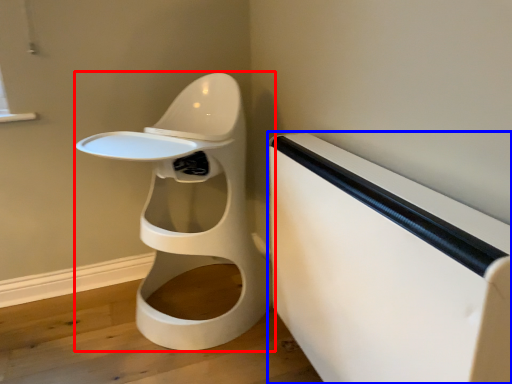
Question: Which object appears farthest to the camera in this image, toilet (highlighted by a red box) or changing table (highlighted by a blue box)?

Choices:
 (A) toilet
 (B) changing table

Answer: (A)